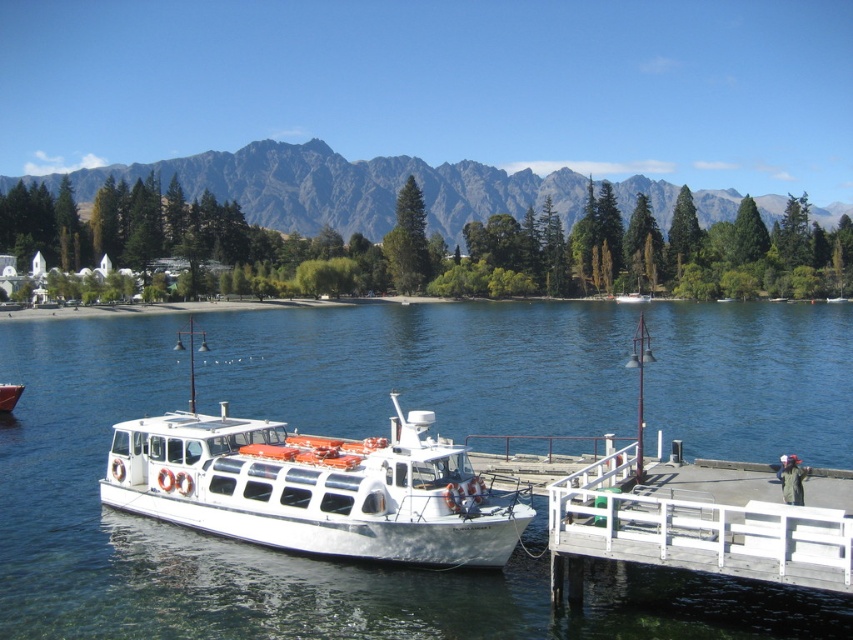
Question: Among these objects, which one is nearest to the camera?

Choices:
 (A) white glossy boat at center
 (B) white glossy boat at lower left

Answer: (A)

Question: Is white glossy boat at center below white glossy boat at lower left?

Choices:
 (A) yes
 (B) no

Answer: (B)

Question: Estimate the real-world distances between objects in this image. Which object is closer to the white glossy boat at center?

Choices:
 (A) clear blue water at center
 (B) white glossy boat at lower left

Answer: (A)

Question: Which object is closer to the camera taking this photo?

Choices:
 (A) gray rocky mountain at upper center
 (B) clear blue water at center

Answer: (B)

Question: Does gray rocky mountain at upper center have a smaller size compared to white glossy boat at lower left?

Choices:
 (A) yes
 (B) no

Answer: (B)

Question: Does clear blue water at center have a smaller size compared to white glossy boat at center?

Choices:
 (A) no
 (B) yes

Answer: (A)